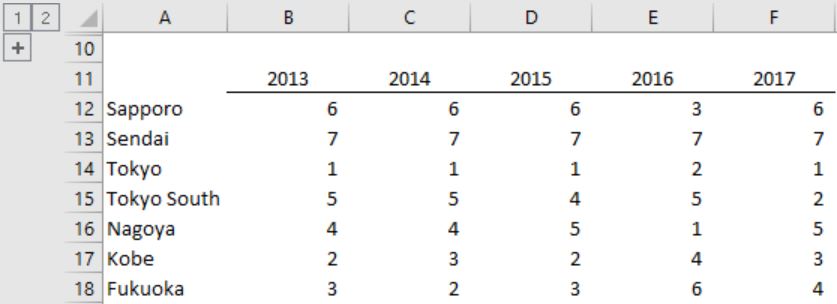
Identify the location of columns. (177, 21), (295, 10), (396, 22), (522, 19), (664, 18), (779, 16).